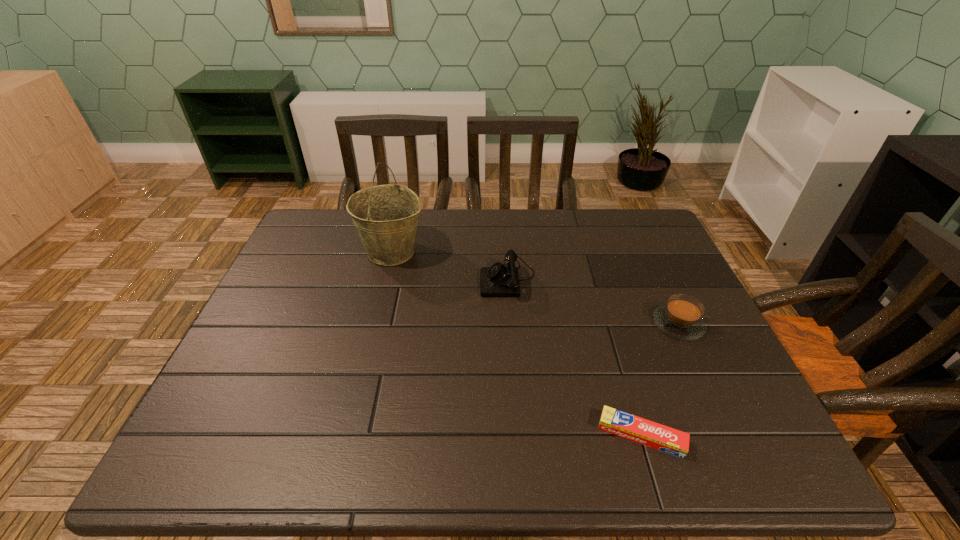
At what (x,y) coordinates should I click in order to perform the action: click on unoccupied area between the telephone and the third tallest object. Please return your answer as a coordinate pair (x, y). Looking at the image, I should click on (593, 301).

Image resolution: width=960 pixels, height=540 pixels. What are the coordinates of `free space between the second nearest object and the third object from left to right` in the screenshot? It's located at (660, 380).

The height and width of the screenshot is (540, 960). Identify the location of vacant area that lies between the third object from right to left and the cappuccino. (593, 301).

Where is `empty space that is in between the second object from left to right and the tallest object`? Image resolution: width=960 pixels, height=540 pixels. empty space that is in between the second object from left to right and the tallest object is located at coordinates (450, 265).

I want to click on object that stands as the closest to the third object from right to left, so click(x=386, y=217).

This screenshot has height=540, width=960. Find the location of `object that ranks as the closest to the rightmost object`. object that ranks as the closest to the rightmost object is located at coordinates (663, 438).

Locate an element on the screen. This screenshot has width=960, height=540. free spot that satisfies the following two spatial constraints: 1. on the back side of the toothpaste; 2. on the front face of the telephone is located at coordinates (594, 278).

The image size is (960, 540). I want to click on free space that satisfies the following two spatial constraints: 1. on the front face of the second object from left to right; 2. on the left side of the nearest object, so click(519, 435).

The height and width of the screenshot is (540, 960). I want to click on vacant position in the image that satisfies the following two spatial constraints: 1. on the front face of the second object from left to right; 2. on the back side of the shortest object, so click(x=519, y=435).

Identify the location of vacant point that satisfies the following two spatial constraints: 1. on the front face of the telephone; 2. on the right side of the second nearest object. Image resolution: width=960 pixels, height=540 pixels. (511, 324).